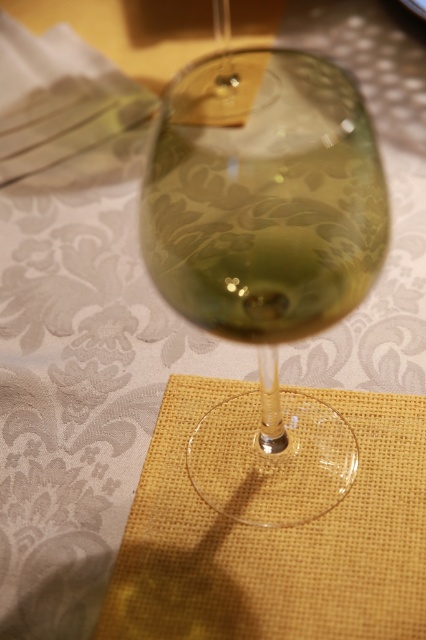
Question: Is transparent glass at center to the left of burlap placemat at center from the viewer's perspective?

Choices:
 (A) no
 (B) yes

Answer: (B)

Question: Is transparent glass at center below burlap placemat at center?

Choices:
 (A) yes
 (B) no

Answer: (B)

Question: Does transparent glass at center appear on the right side of burlap placemat at center?

Choices:
 (A) yes
 (B) no

Answer: (B)

Question: Which point is farther to the camera?

Choices:
 (A) (132, 529)
 (B) (218, 81)

Answer: (A)

Question: Which point appears closest to the camera in this image?

Choices:
 (A) (198, 481)
 (B) (259, 620)

Answer: (B)